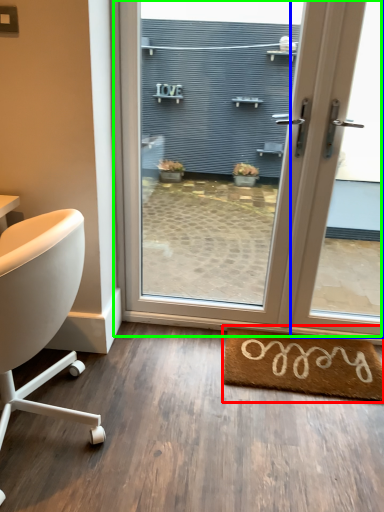
Question: Based on their relative distances, which object is nearer to mat (highlighted by a red box)? Choose from window (highlighted by a blue box) and door (highlighted by a green box).

Choices:
 (A) window
 (B) door

Answer: (A)